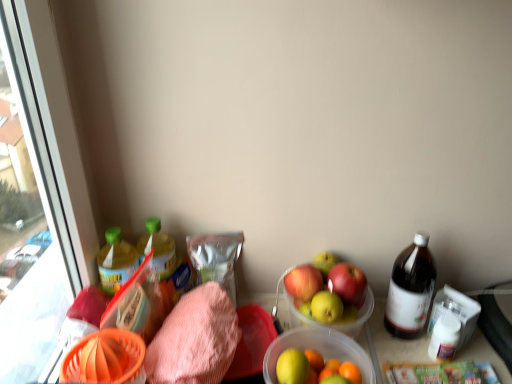
Question: Does point (273, 375) appear closer or farther from the camera than point (415, 276)?

Choices:
 (A) farther
 (B) closer

Answer: (B)

Question: In terms of width, does translucent plastic bowl at center look wider or thinner when compared to brown glass bottle at right, arranged as the 3th bottle when viewed from the left?

Choices:
 (A) thin
 (B) wide

Answer: (B)

Question: Estimate the real-world distances between objects in this image. Which object is closer to the translucent plastic bowl at center?

Choices:
 (A) green plastic bottle at left, the third bottle in the right-to-left sequence
 (B) green plastic bottle at left, arranged as the 2th bottle when viewed from the left
 (C) pink terry cloth towel at lower left
 (D) brown glass bottle at right, the 1th bottle viewed from the right

Answer: (C)

Question: Which of these objects is positioned closest to the green plastic bottle at left, the third bottle in the right-to-left sequence?

Choices:
 (A) brown glass bottle at right, the 1th bottle viewed from the right
 (B) translucent plastic bowl at center
 (C) green plastic bottle at left, the 2th bottle positioned from the right
 (D) pink terry cloth towel at lower left

Answer: (C)